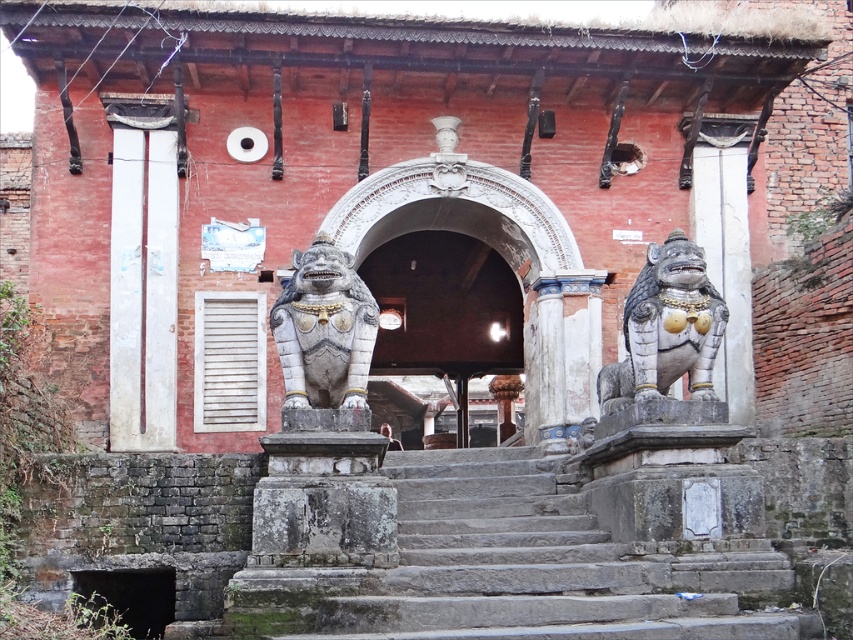
Which is more to the right, dark stone archway at center or polished stone lion at right?

polished stone lion at right is more to the right.

Who is higher up, dark stone archway at center or polished stone lion at right?

Positioned higher is dark stone archway at center.

What are the coordinates of `dark stone archway at center` in the screenshot? It's located at (445, 307).

Between gray stone stairs at center and white painted wood at left, which one appears on the left side from the viewer's perspective?

From the viewer's perspective, white painted wood at left appears more on the left side.

This screenshot has width=853, height=640. I want to click on gray stone stairs at center, so click(x=544, y=566).

Where is `gray stone stairs at center`? The height and width of the screenshot is (640, 853). gray stone stairs at center is located at coordinates (544, 566).

Does white painted wood at left appear on the left side of polished stone lion at right?

Indeed, white painted wood at left is positioned on the left side of polished stone lion at right.

Is point (166, 154) more distant than point (694, 310)?

Yes, it is.

Is point (138, 294) positioned before point (711, 310)?

No, it is not.

At what (x,y) coordinates should I click in order to perform the action: click on white painted wood at left. Please return your answer as a coordinate pair (x, y). This screenshot has width=853, height=640. Looking at the image, I should click on (143, 284).